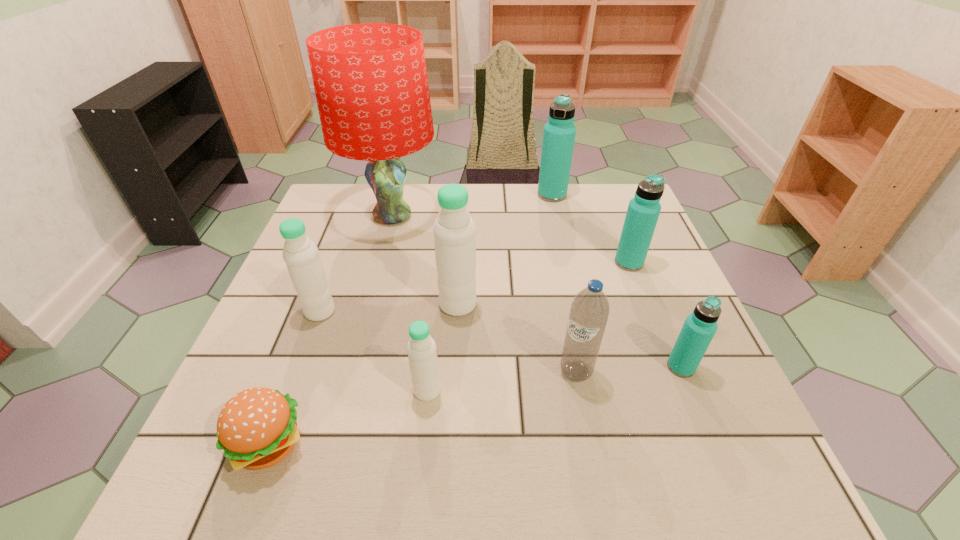
The height and width of the screenshot is (540, 960). Find the location of `lampshade present at the far edge`. lampshade present at the far edge is located at coordinates (370, 79).

Image resolution: width=960 pixels, height=540 pixels. Identify the location of water bottle that is at the far edge. (559, 133).

What are the coordinates of `object that is at the near edge` in the screenshot? It's located at (257, 428).

Where is `lampshade situated at the left edge`? The height and width of the screenshot is (540, 960). lampshade situated at the left edge is located at coordinates pyautogui.click(x=370, y=79).

This screenshot has width=960, height=540. I want to click on water bottle at the left edge, so click(304, 265).

Locate an element on the screen. hamburger situated at the left edge is located at coordinates (257, 428).

The width and height of the screenshot is (960, 540). Identify the location of object that is at the far left corner. tap(370, 79).

Find the location of a particular element. The height and width of the screenshot is (540, 960). object located in the near left corner section of the desktop is located at coordinates (257, 428).

Locate an element on the screen. The width and height of the screenshot is (960, 540). vacant space at the far edge of the desktop is located at coordinates 576,193.

In the image, there is a desktop. What are the coordinates of `vacant space at the near edge` in the screenshot? It's located at (536, 484).